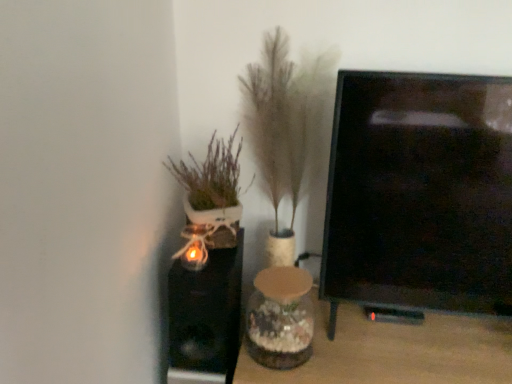
The width and height of the screenshot is (512, 384). What do you see at coordinates (284, 127) in the screenshot? I see `fuzzy beige plant at center, which is the 1th houseplant from right to left` at bounding box center [284, 127].

The image size is (512, 384). I want to click on white ceramic pot at left, arranged as the second houseplant when viewed from the right, so click(212, 192).

Considering the relative sizes of white ceramic pot at left, arranged as the second houseplant when viewed from the right, and translucent glass vase at center in the image provided, is white ceramic pot at left, arranged as the second houseplant when viewed from the right, wider than translucent glass vase at center?

Incorrect, the width of white ceramic pot at left, arranged as the second houseplant when viewed from the right, does not surpass that of translucent glass vase at center.

Could you tell me if white ceramic pot at left, arranged as the second houseplant when viewed from the right, is facing translucent glass vase at center?

No, white ceramic pot at left, arranged as the second houseplant when viewed from the right, is not turned towards translucent glass vase at center.

Does white ceramic pot at left, marked as the first houseplant in a left-to-right arrangement, come in front of translucent glass vase at center?

No, white ceramic pot at left, marked as the first houseplant in a left-to-right arrangement, is further to the viewer.

How many degrees apart are the facing directions of fuzzy beige plant at center, which is the 1th houseplant from right to left, and translucent glass vase at center?

1.09 degrees.

Is fuzzy beige plant at center, which is the 1th houseplant from right to left, at the right side of translucent glass vase at center?

Yes.

Who is shorter, fuzzy beige plant at center, the 2th houseplant when ordered from left to right, or translucent glass vase at center?

translucent glass vase at center.

Who is bigger, fuzzy beige plant at center, which is the 1th houseplant from right to left, or translucent glass vase at center?

Bigger between the two is fuzzy beige plant at center, which is the 1th houseplant from right to left.

This screenshot has height=384, width=512. What are the coordinates of `furniture in front of the translucent glass vase at center` in the screenshot? It's located at (395, 352).

From the image's perspective, which object appears higher, clear glass vase at center or translucent glass vase at center?

From the image's view, translucent glass vase at center is above.

Based on the photo, considering the sizes of clear glass vase at center and translucent glass vase at center in the image, is clear glass vase at center bigger or smaller than translucent glass vase at center?

clear glass vase at center is bigger than translucent glass vase at center.

Is clear glass vase at center located outside translucent glass vase at center?

Yes, clear glass vase at center is located beyond the bounds of translucent glass vase at center.

Is translucent glass vase at center not close to clear glass vase at center?

They are positioned close to each other.

Is translucent glass vase at center not inside clear glass vase at center?

Yes, translucent glass vase at center is located beyond the bounds of clear glass vase at center.

Considering the points (262, 348) and (368, 373), which point is in front, point (262, 348) or point (368, 373)?

The point (368, 373) is more forward.

Does clear glass vase at center have a lesser width compared to fuzzy beige plant at center, which is the 1th houseplant from right to left?

No.

From a real-world perspective, which object rests below the other?

clear glass vase at center.

You are a GUI agent. You are given a task and a screenshot of the screen. Output one action in this format:
    pyautogui.click(x=<x>, y=<y>)
    Task: Click on the 2nd houseplant positioned above the clear glass vase at center (from the image's perspective)
    The width and height of the screenshot is (512, 384).
    Given the screenshot: What is the action you would take?
    pyautogui.click(x=284, y=127)

Considering the sizes of white ceramic pot at left, arranged as the second houseplant when viewed from the right, and fuzzy beige plant at center, the 2th houseplant when ordered from left to right, in the image, is white ceramic pot at left, arranged as the second houseplant when viewed from the right, taller or shorter than fuzzy beige plant at center, the 2th houseplant when ordered from left to right,?

white ceramic pot at left, arranged as the second houseplant when viewed from the right, is shorter than fuzzy beige plant at center, the 2th houseplant when ordered from left to right.

Consider the image. Would you say white ceramic pot at left, marked as the first houseplant in a left-to-right arrangement, is inside or outside fuzzy beige plant at center, the 2th houseplant when ordered from left to right?

The correct answer is: outside.

Based on their sizes in the image, would you say white ceramic pot at left, marked as the first houseplant in a left-to-right arrangement, is bigger or smaller than fuzzy beige plant at center, which is the 1th houseplant from right to left?

Clearly, white ceramic pot at left, marked as the first houseplant in a left-to-right arrangement, is smaller in size than fuzzy beige plant at center, which is the 1th houseplant from right to left.

From a real-world perspective, is white ceramic pot at left, marked as the first houseplant in a left-to-right arrangement, above or below fuzzy beige plant at center, which is the 1th houseplant from right to left?

white ceramic pot at left, marked as the first houseplant in a left-to-right arrangement, is situated higher than fuzzy beige plant at center, which is the 1th houseplant from right to left, in the real world.

Is translucent glass vase at center bigger or smaller than white ceramic pot at left, arranged as the second houseplant when viewed from the right?

Clearly, translucent glass vase at center is larger in size than white ceramic pot at left, arranged as the second houseplant when viewed from the right.

Is translucent glass vase at center wider than white ceramic pot at left, arranged as the second houseplant when viewed from the right?

Correct, the width of translucent glass vase at center exceeds that of white ceramic pot at left, arranged as the second houseplant when viewed from the right.

Considering the positions of objects translucent glass vase at center and white ceramic pot at left, arranged as the second houseplant when viewed from the right, in the image provided, who is more to the right, translucent glass vase at center or white ceramic pot at left, arranged as the second houseplant when viewed from the right,?

translucent glass vase at center is more to the right.

The image size is (512, 384). I want to click on houseplant lying on the left of translucent glass vase at center, so click(212, 192).

Identify the location of vase below the fuzzy beige plant at center, the 2th houseplant when ordered from left to right (from the image's perspective). (280, 318).

Estimate the real-world distances between objects in this image. Which object is closer to fuzzy beige plant at center, which is the 1th houseplant from right to left, clear glass vase at center or white ceramic pot at left, marked as the first houseplant in a left-to-right arrangement?

white ceramic pot at left, marked as the first houseplant in a left-to-right arrangement, is positioned closer to the anchor fuzzy beige plant at center, which is the 1th houseplant from right to left.

Considering their positions, is white ceramic pot at left, arranged as the second houseplant when viewed from the right, positioned closer to fuzzy beige plant at center, which is the 1th houseplant from right to left, than translucent glass vase at center?

Among the two, white ceramic pot at left, arranged as the second houseplant when viewed from the right, is located nearer to fuzzy beige plant at center, which is the 1th houseplant from right to left.

From the image, which object appears to be farther from translucent glass vase at center, white ceramic pot at left, arranged as the second houseplant when viewed from the right, or fuzzy beige plant at center, which is the 1th houseplant from right to left?

fuzzy beige plant at center, which is the 1th houseplant from right to left, is positioned further to the anchor translucent glass vase at center.

Considering their positions, is white ceramic pot at left, arranged as the second houseplant when viewed from the right, positioned further to translucent glass vase at center than clear glass vase at center?

Based on the image, white ceramic pot at left, arranged as the second houseplant when viewed from the right, appears to be further to translucent glass vase at center.

From the image, which object appears to be nearer to fuzzy beige plant at center, which is the 1th houseplant from right to left, white ceramic pot at left, arranged as the second houseplant when viewed from the right, or clear glass vase at center?

The object closer to fuzzy beige plant at center, which is the 1th houseplant from right to left, is white ceramic pot at left, arranged as the second houseplant when viewed from the right.

Estimate the real-world distances between objects in this image. Which object is closer to clear glass vase at center, white ceramic pot at left, marked as the first houseplant in a left-to-right arrangement, or translucent glass vase at center?

translucent glass vase at center lies closer to clear glass vase at center than the other object.

When comparing their distances from translucent glass vase at center, does clear glass vase at center or fuzzy beige plant at center, which is the 1th houseplant from right to left, seem closer?

clear glass vase at center.

Consider the image. Looking at the image, which one is located further to fuzzy beige plant at center, the 2th houseplant when ordered from left to right, translucent glass vase at center or white ceramic pot at left, arranged as the second houseplant when viewed from the right?

The object further to fuzzy beige plant at center, the 2th houseplant when ordered from left to right, is translucent glass vase at center.

This screenshot has height=384, width=512. In order to click on vase between white ceramic pot at left, marked as the first houseplant in a left-to-right arrangement, and clear glass vase at center in the up-down direction in this screenshot , I will do `click(280, 318)`.

Where is `houseplant that lies between fuzzy beige plant at center, the 2th houseplant when ordered from left to right, and translucent glass vase at center from top to bottom`? The width and height of the screenshot is (512, 384). houseplant that lies between fuzzy beige plant at center, the 2th houseplant when ordered from left to right, and translucent glass vase at center from top to bottom is located at coordinates (212, 192).

Locate an element on the screen. houseplant that lies between fuzzy beige plant at center, the 2th houseplant when ordered from left to right, and clear glass vase at center from top to bottom is located at coordinates (212, 192).

Image resolution: width=512 pixels, height=384 pixels. Find the location of `vase that lies between fuzzy beige plant at center, which is the 1th houseplant from right to left, and clear glass vase at center from top to bottom`. vase that lies between fuzzy beige plant at center, which is the 1th houseplant from right to left, and clear glass vase at center from top to bottom is located at coordinates (280, 318).